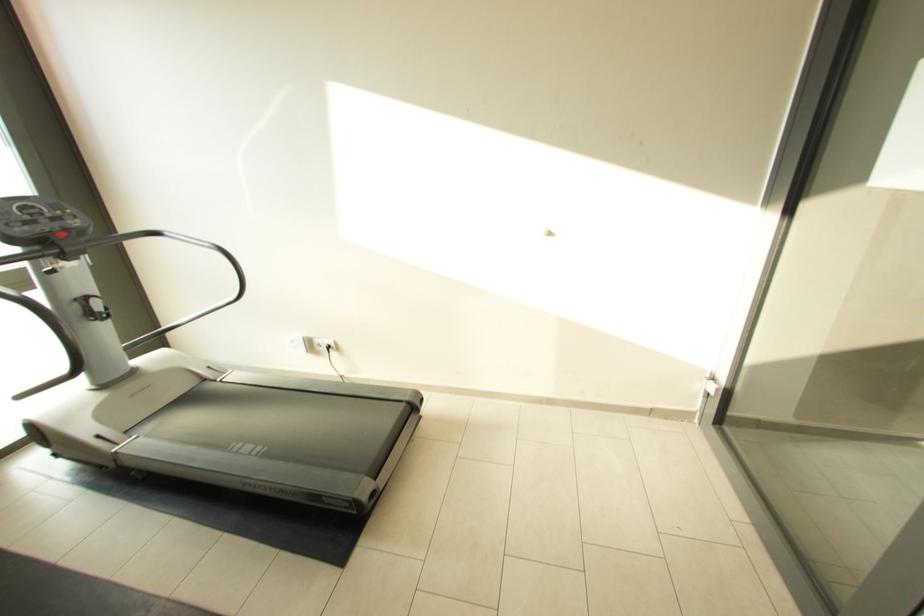
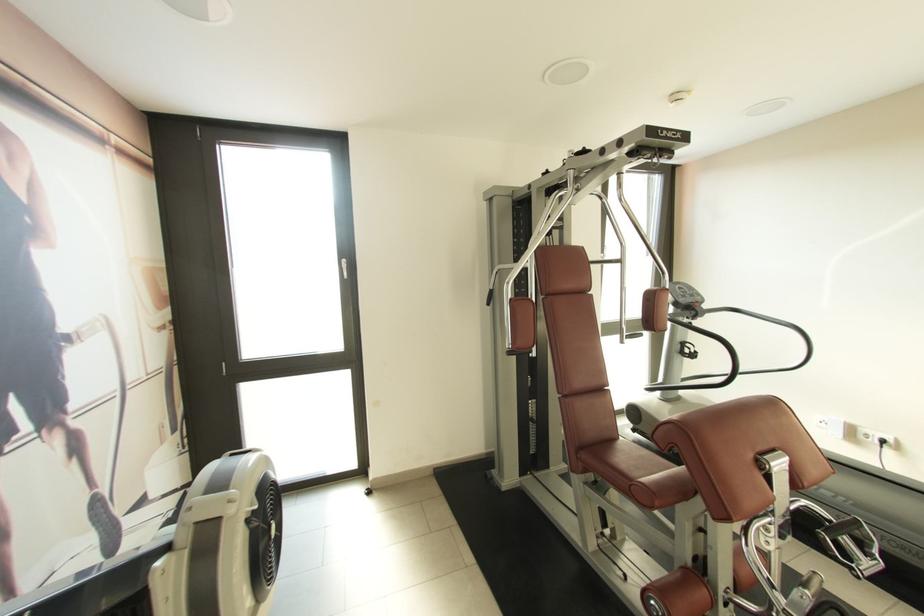
Locate, in the second image, the point that corresponds to (322,342) in the first image.

(868, 432)